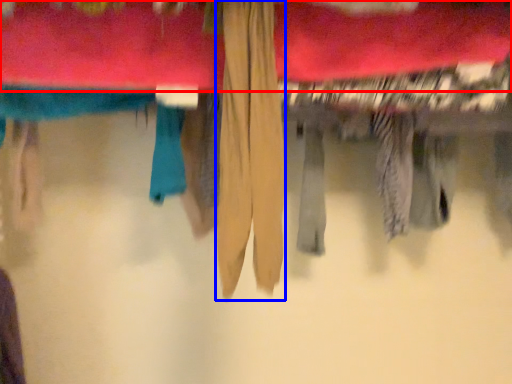
Question: Which point is further to the camera, towel (highlighted by a red box) or clothing (highlighted by a blue box)?

Choices:
 (A) towel
 (B) clothing

Answer: (A)